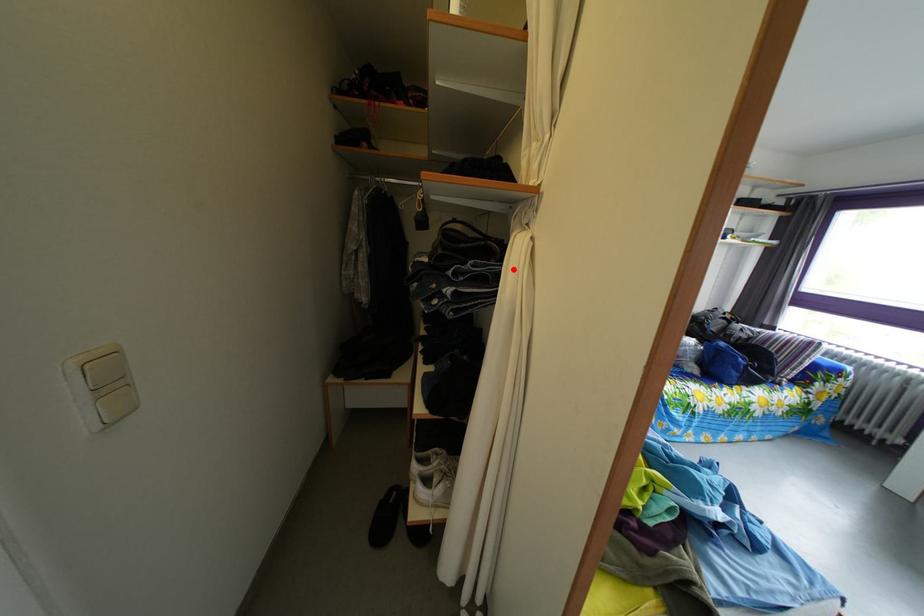
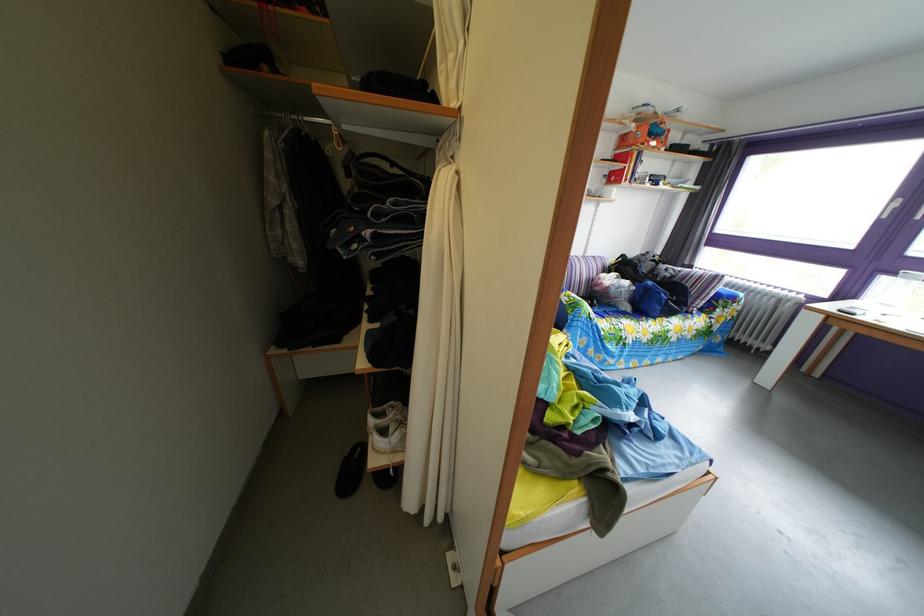
The point at the highlighted location is marked in the first image. Where is the corresponding point in the second image?

(438, 207)